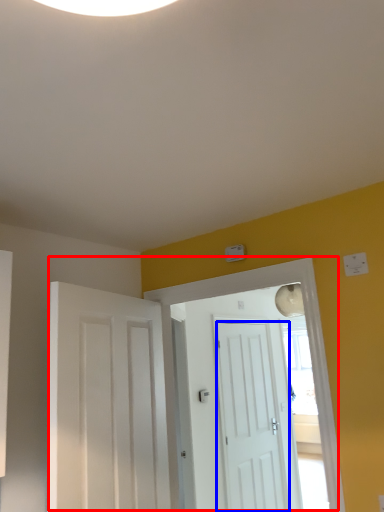
Question: Which point is closer to the camera, door (highlighted by a red box) or door (highlighted by a blue box)?

Choices:
 (A) door
 (B) door

Answer: (A)